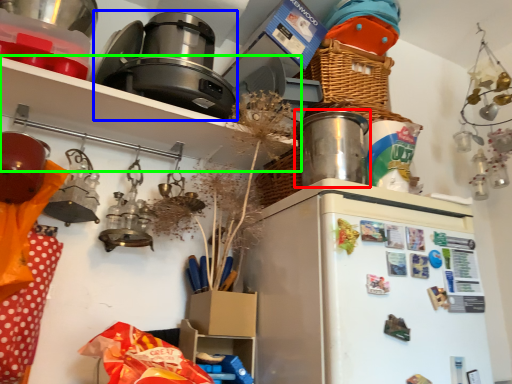
Question: Based on their relative distances, which object is nearer to appliance (highlighted by a red box)? Choose from appliance (highlighted by a blue box) and shelf (highlighted by a green box).

Choices:
 (A) appliance
 (B) shelf

Answer: (B)